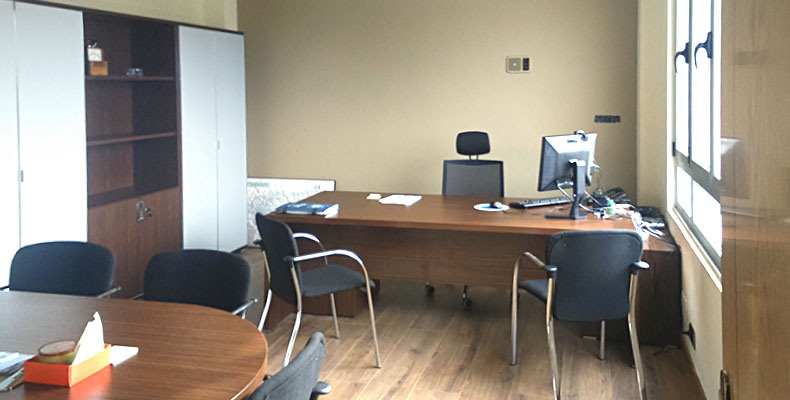
Image resolution: width=790 pixels, height=400 pixels. In order to click on chairs in this screenshot , I will do `click(604, 273)`, `click(329, 279)`, `click(77, 269)`, `click(302, 371)`, `click(476, 171)`.